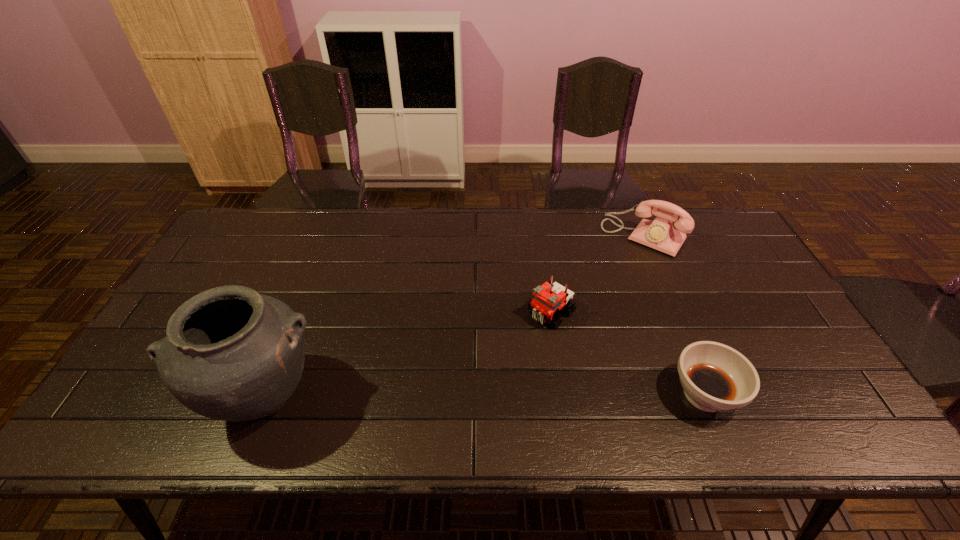
Find the location of `vacant space located on the front-facing side of the third tallest object`. vacant space located on the front-facing side of the third tallest object is located at coordinates point(508,352).

Identify the location of blank area located on the front-facing side of the third tallest object. This screenshot has width=960, height=540. [x=513, y=347].

Locate an element on the screen. vacant space situated 0.240m on the dial of the farthest object is located at coordinates (594, 298).

You are a GUI agent. You are given a task and a screenshot of the screen. Output one action in this format:
    pyautogui.click(x=<x>, y=<y>)
    Task: Click on the free location located on the dial of the farthest object
    Image resolution: width=960 pixels, height=540 pixels.
    Given the screenshot: What is the action you would take?
    pyautogui.click(x=589, y=305)

Identify the location of vacant area situated 0.260m on the dial of the farthest object. The width and height of the screenshot is (960, 540). (591, 302).

Where is `object at the far edge`? The image size is (960, 540). object at the far edge is located at coordinates tap(660, 234).

This screenshot has width=960, height=540. In order to click on urn located in the near edge section of the desktop in this screenshot , I will do `click(231, 354)`.

This screenshot has width=960, height=540. Identify the location of soup bowl that is at the near edge. (715, 377).

Locate an element on the screen. vacant space at the far edge of the desktop is located at coordinates (619, 232).

This screenshot has height=540, width=960. In order to click on free region at the near edge of the desktop in this screenshot , I will do `click(445, 390)`.